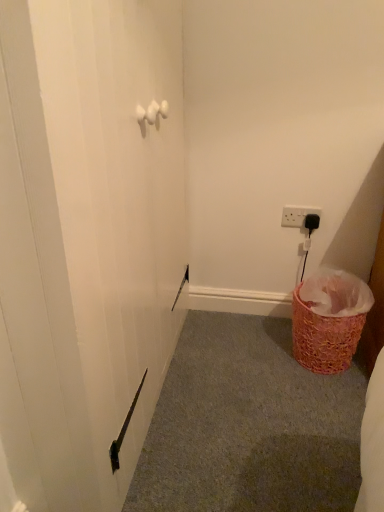
Question: From the image's perspective, is white plastic electric outlet at upper right positioned above or below ruffled pink basket at lower right?

Choices:
 (A) below
 (B) above

Answer: (B)

Question: Is white plastic electric outlet at upper right inside the boundaries of ruffled pink basket at lower right, or outside?

Choices:
 (A) outside
 (B) inside

Answer: (A)

Question: Estimate the real-world distances between objects in this image. Which object is farther from the pink woven basket at lower right?

Choices:
 (A) white plastic electric outlet at upper right
 (B) ruffled pink basket at lower right

Answer: (A)

Question: Estimate the real-world distances between objects in this image. Which object is closer to the ruffled pink basket at lower right?

Choices:
 (A) white plastic electric outlet at upper right
 (B) pink woven basket at lower right

Answer: (B)